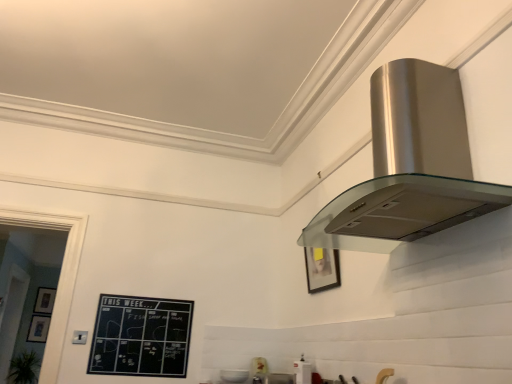
Locate an element on the screen. matte black picture frame at upper right, marked as the third picture frame in a bottom-to-top arrangement is located at coordinates (322, 269).

What do you see at coordinates (322, 269) in the screenshot? I see `matte black picture frame at upper right, which appears as the 3th picture frame when viewed from the left` at bounding box center [322, 269].

At what (x,y) coordinates should I click in order to perform the action: click on matte white toaster at lower center, which appears as the third appliance when viewed from the front. Please return your answer as a coordinate pair (x, y). The width and height of the screenshot is (512, 384). Looking at the image, I should click on (259, 370).

This screenshot has height=384, width=512. Describe the element at coordinates (234, 376) in the screenshot. I see `satin silver range hood at upper right, which is the second appliance from back to front` at that location.

How much space does matte black picture frame at lower left, which ranks as the third picture frame in front-to-back order, occupy horizontally?

It is 3.02 inches.

The image size is (512, 384). I want to click on matte black picture frame at lower left, the third picture frame positioned from the top, so click(38, 328).

How far apart are satin silver range hood at upper right, the 3th appliance in the left-to-right sequence, and satin silver range hood at upper right, the 2th appliance viewed from the front?

satin silver range hood at upper right, the 3th appliance in the left-to-right sequence, is 54.41 centimeters from satin silver range hood at upper right, the 2th appliance viewed from the front.

How different are the orientations of satin silver range hood at upper right, arranged as the 3th appliance when viewed from the back, and satin silver range hood at upper right, which appears as the first appliance when viewed from the left, in degrees?

satin silver range hood at upper right, arranged as the 3th appliance when viewed from the back, and satin silver range hood at upper right, which appears as the first appliance when viewed from the left, are facing 9.73 degrees away from each other.

Between satin silver range hood at upper right, arranged as the 3th appliance when viewed from the back, and satin silver range hood at upper right, which appears as the first appliance when viewed from the left, which one appears on the left side from the viewer's perspective?

satin silver range hood at upper right, which appears as the first appliance when viewed from the left.

Could you tell me if satin silver range hood at upper right, the 3th appliance in the left-to-right sequence, is turned towards satin silver range hood at upper right, which is counted as the third appliance, starting from the right?

No, satin silver range hood at upper right, the 3th appliance in the left-to-right sequence, is not aimed at satin silver range hood at upper right, which is counted as the third appliance, starting from the right.

Which object is closer to the camera, black chalkboard at lower left or satin silver range hood at upper right?

satin silver range hood at upper right is in front.

Is black chalkboard at lower left oriented towards satin silver range hood at upper right?

Yes, black chalkboard at lower left is facing satin silver range hood at upper right.

From a real-world perspective, is black chalkboard at lower left physically below satin silver range hood at upper right?

Correct, in the physical world, black chalkboard at lower left is lower than satin silver range hood at upper right.

Considering the relative sizes of black chalkboard at lower left and satin silver range hood at upper right in the image provided, is black chalkboard at lower left smaller than satin silver range hood at upper right?

Yes.

Is matte black picture frame at lower left, the 3th picture frame viewed from the right, surrounded by satin silver range hood at upper right, the first appliance viewed from the front?

No, matte black picture frame at lower left, the 3th picture frame viewed from the right, is located outside of satin silver range hood at upper right, the first appliance viewed from the front.

Consider the image. From the image's perspective, is satin silver range hood at upper right, the 3th appliance in the left-to-right sequence, located above or below matte black picture frame at lower left, which is the 1th picture frame in left-to-right order?

From the image's perspective, satin silver range hood at upper right, the 3th appliance in the left-to-right sequence, appears above matte black picture frame at lower left, which is the 1th picture frame in left-to-right order.

Is satin silver range hood at upper right, arranged as the 3th appliance when viewed from the back, wider or thinner than matte black picture frame at lower left, acting as the 1th picture frame starting from the bottom?

satin silver range hood at upper right, arranged as the 3th appliance when viewed from the back, is wider than matte black picture frame at lower left, acting as the 1th picture frame starting from the bottom.

Considering the positions of objects satin silver range hood at upper right, arranged as the 3th appliance when viewed from the back, and matte black picture frame at lower left, which is the 1th picture frame in left-to-right order, in the image provided, who is in front, satin silver range hood at upper right, arranged as the 3th appliance when viewed from the back, or matte black picture frame at lower left, which is the 1th picture frame in left-to-right order,?

satin silver range hood at upper right, arranged as the 3th appliance when viewed from the back, is in front.

Is satin silver range hood at upper right directly adjacent to matte white toaster at lower center, which appears as the third appliance when viewed from the front?

No, satin silver range hood at upper right is not with matte white toaster at lower center, which appears as the third appliance when viewed from the front.

What's the angular difference between satin silver range hood at upper right and matte white toaster at lower center, marked as the 2th appliance in a right-to-left arrangement,'s facing directions?

satin silver range hood at upper right and matte white toaster at lower center, marked as the 2th appliance in a right-to-left arrangement, are facing 87.3 degrees away from each other.

This screenshot has height=384, width=512. What are the coordinates of `home appliance that is on the right side of matte white toaster at lower center, marked as the 2th appliance in a right-to-left arrangement` in the screenshot? It's located at (409, 166).

Can you confirm if satin silver range hood at upper right is thinner than matte white toaster at lower center, which is counted as the second appliance, starting from the left?

No, satin silver range hood at upper right is not thinner than matte white toaster at lower center, which is counted as the second appliance, starting from the left.

Does matte white toaster at lower center, placed as the 1th appliance when sorted from back to front, lie behind satin silver range hood at upper right, which is the second appliance from back to front?

Yes, it is.

Between matte white toaster at lower center, which appears as the third appliance when viewed from the front, and satin silver range hood at upper right, which appears as the first appliance when viewed from the left, which one appears on the right side from the viewer's perspective?

From the viewer's perspective, matte white toaster at lower center, which appears as the third appliance when viewed from the front, appears more on the right side.

Considering the sizes of matte white toaster at lower center, marked as the 2th appliance in a right-to-left arrangement, and satin silver range hood at upper right, the 2th appliance viewed from the front, in the image, is matte white toaster at lower center, marked as the 2th appliance in a right-to-left arrangement, bigger or smaller than satin silver range hood at upper right, the 2th appliance viewed from the front,?

matte white toaster at lower center, marked as the 2th appliance in a right-to-left arrangement, is smaller than satin silver range hood at upper right, the 2th appliance viewed from the front.

I want to click on appliance below the matte white toaster at lower center, which is counted as the second appliance, starting from the left (from the image's perspective), so click(234, 376).

Is satin silver range hood at upper right in front of or behind matte black picture frame at upper right, which appears as the 3th picture frame when viewed from the left, in the image?

Visually, satin silver range hood at upper right is located in front of matte black picture frame at upper right, which appears as the 3th picture frame when viewed from the left.

From a real-world perspective, who is located lower, satin silver range hood at upper right or matte black picture frame at upper right, which appears as the 3th picture frame when viewed from the left?

matte black picture frame at upper right, which appears as the 3th picture frame when viewed from the left, from a real-world perspective.

Is point (446, 171) positioned before point (319, 278)?

Yes.

From the image's perspective, is satin silver range hood at upper right located beneath matte black picture frame at upper right, which appears as the 3th picture frame when viewed from the left?

No, from the image's perspective, satin silver range hood at upper right is not below matte black picture frame at upper right, which appears as the 3th picture frame when viewed from the left.

From the image's perspective, is matte black picture frame at lower left, the third picture frame positioned from the top, below matte black picture frame at upper right, the 1th picture frame in the right-to-left sequence?

Yes, from the image's perspective, matte black picture frame at lower left, the third picture frame positioned from the top, is below matte black picture frame at upper right, the 1th picture frame in the right-to-left sequence.

Is point (46, 335) closer or farther from the camera than point (336, 275)?

Point (46, 335) is farther from the camera than point (336, 275).

Locate an element on the screen. This screenshot has width=512, height=384. picture frame in front of the matte black picture frame at lower left, placed as the 2th picture frame when sorted from front to back is located at coordinates (322, 269).

Can you confirm if matte black picture frame at lower left, the 2th picture frame viewed from the back, is shorter than matte black picture frame at upper right, the first picture frame in the top-to-bottom sequence?

Correct, matte black picture frame at lower left, the 2th picture frame viewed from the back, is not as tall as matte black picture frame at upper right, the first picture frame in the top-to-bottom sequence.

Locate an element on the screen. the 2nd appliance positioned below the satin silver range hood at upper right, which is the first appliance from right to left (from the image's perspective) is located at coordinates (234, 376).

Where is `home appliance in front of the black chalkboard at lower left`? The height and width of the screenshot is (384, 512). home appliance in front of the black chalkboard at lower left is located at coordinates (409, 166).

Estimate the real-world distances between objects in this image. Which object is closer to matte black picture frame at upper right, the third picture frame viewed from the back, matte white toaster at lower center, which is counted as the second appliance, starting from the left, or matte black picture frame at lower left, which is the 1th picture frame in left-to-right order?

matte white toaster at lower center, which is counted as the second appliance, starting from the left.

From the image, which object appears to be nearer to satin silver range hood at upper right, which appears as the first appliance when viewed from the left, satin silver range hood at upper right or matte white toaster at lower center, marked as the 2th appliance in a right-to-left arrangement?

matte white toaster at lower center, marked as the 2th appliance in a right-to-left arrangement, lies closer to satin silver range hood at upper right, which appears as the first appliance when viewed from the left, than the other object.

Estimate the real-world distances between objects in this image. Which object is closer to matte white toaster at lower center, marked as the 2th appliance in a right-to-left arrangement, matte black picture frame at upper right, the first picture frame in the top-to-bottom sequence, or satin silver range hood at upper right, arranged as the 3th appliance when viewed from the back?

Among the two, satin silver range hood at upper right, arranged as the 3th appliance when viewed from the back, is located nearer to matte white toaster at lower center, marked as the 2th appliance in a right-to-left arrangement.

Based on their spatial positions, is matte white toaster at lower center, placed as the 1th appliance when sorted from back to front, or matte black picture frame at upper right, the first picture frame positioned from the front, closer to matte black picture frame at lower left, positioned as the first picture frame in back-to-front order?

Among the two, matte white toaster at lower center, placed as the 1th appliance when sorted from back to front, is located nearer to matte black picture frame at lower left, positioned as the first picture frame in back-to-front order.

Looking at the image, which one is located further to black chalkboard at lower left, matte black picture frame at upper right, the first picture frame in the top-to-bottom sequence, or satin silver range hood at upper right, the first appliance viewed from the front?

matte black picture frame at upper right, the first picture frame in the top-to-bottom sequence.

Based on the photo, based on their spatial positions, is matte black picture frame at lower left, which ranks as the third picture frame in front-to-back order, or black chalkboard at lower left further from matte black picture frame at upper right, marked as the third picture frame in a bottom-to-top arrangement?

matte black picture frame at lower left, which ranks as the third picture frame in front-to-back order, is further to matte black picture frame at upper right, marked as the third picture frame in a bottom-to-top arrangement.

Looking at this image, from the image, which object appears to be nearer to satin silver range hood at upper right, the first appliance viewed from the front, matte white toaster at lower center, which is counted as the second appliance, starting from the left, or black chalkboard at lower left?

Among the two, matte white toaster at lower center, which is counted as the second appliance, starting from the left, is located nearer to satin silver range hood at upper right, the first appliance viewed from the front.

Looking at the image, which one is located further to matte black picture frame at lower left, the 3th picture frame viewed from the right, satin silver range hood at upper right or matte black picture frame at lower left, positioned as the first picture frame in back-to-front order?

satin silver range hood at upper right is further to matte black picture frame at lower left, the 3th picture frame viewed from the right.

At what (x,y) coordinates should I click in order to perform the action: click on picture frame between satin silver range hood at upper right and black chalkboard at lower left from front to back. Please return your answer as a coordinate pair (x, y). Image resolution: width=512 pixels, height=384 pixels. Looking at the image, I should click on point(322,269).

Identify the location of appliance between black chalkboard at lower left and matte white toaster at lower center, marked as the 2th appliance in a right-to-left arrangement, in the horizontal direction. 234,376.

At what (x,y) coordinates should I click in order to perform the action: click on bulletin board located between satin silver range hood at upper right, which is the first appliance from right to left, and matte black picture frame at lower left, acting as the 1th picture frame starting from the bottom, in the depth direction. Please return your answer as a coordinate pair (x, y). Looking at the image, I should click on (141, 336).

In order to click on picture frame between matte black picture frame at upper right, the first picture frame positioned from the front, and matte black picture frame at lower left, which is the second picture frame in left-to-right order, along the z-axis in this screenshot , I will do `click(38, 328)`.